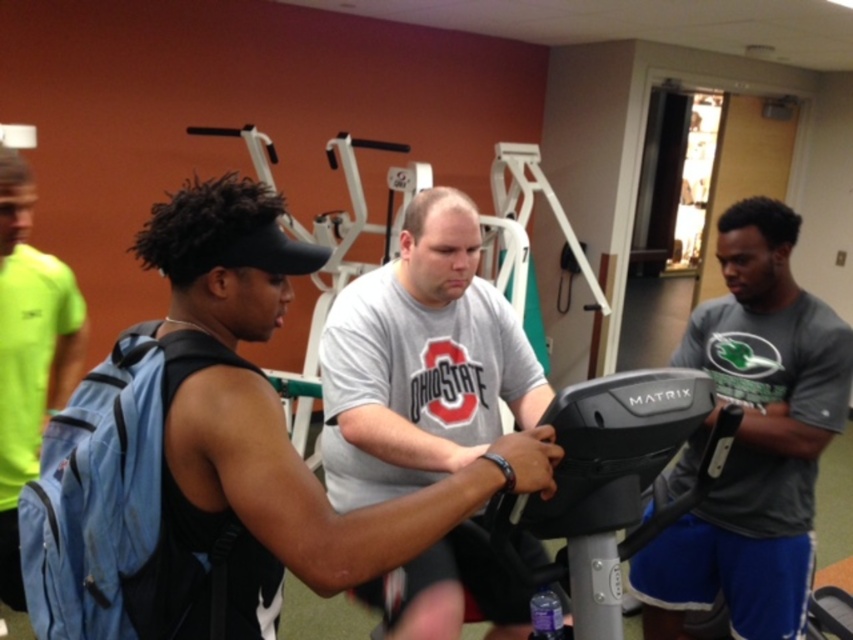
You are a gym trainer observing the scene. You notice the gray matte shirt at center and the denim backpack at left. Which object is positioned lower in the image?

The gray matte shirt at center is positioned below the denim backpack at left, so it is lower in the image.

You are a gym trainer who needs to retrieve a water bottle from the denim backpack at left while instructing a client on the MATRIX machine. Can you reach the backpack without leaving your position near the black matte tank top at center?

The black matte tank top at center is 99.39 centimeters away from the denim backpack at left. Since the distance is approximately 1 meter, you can likely reach the backpack from your current position near the black matte tank top at center if you stretch out your arm.

You are standing at point (44, 324) and want to walk to the MATRIX cardio equipment in the gym. Is the point (51, 419) in your path?

Yes, point (51, 419) is in front of point (44, 324), so it is in your path to the MATRIX cardio equipment.